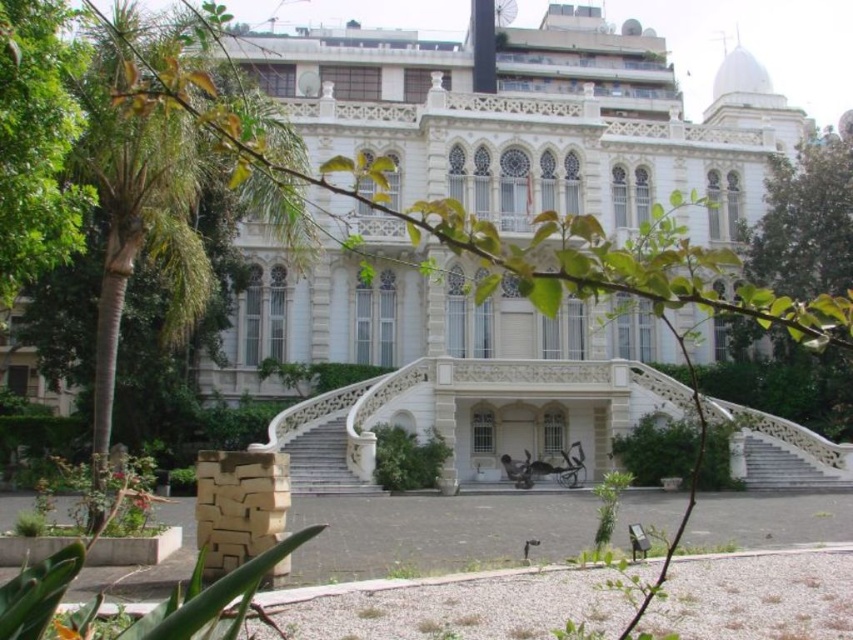
Who is more forward, (306, 481) or (802, 467)?

Point (306, 481) is in front.

Who is more forward, (x=328, y=460) or (x=811, y=476)?

Point (x=328, y=460) is more forward.

Where is `white marble staircase at center`? white marble staircase at center is located at coordinates (323, 461).

In the scene shown: Is green leafy tree at upper right to the right of white marble staircase at center from the viewer's perspective?

Indeed, green leafy tree at upper right is positioned on the right side of white marble staircase at center.

In order to click on green leafy tree at upper right in this screenshot , I will do `click(805, 220)`.

Who is more distant from viewer, (811, 200) or (310, 477)?

The point (811, 200) is behind.

Image resolution: width=853 pixels, height=640 pixels. I want to click on green leafy tree at upper right, so click(805, 220).

Is green leafy tree at left bigger than white stone staircase at center?

Correct, green leafy tree at left is larger in size than white stone staircase at center.

At what (x,y) coordinates should I click in order to perform the action: click on green leafy tree at left. Please return your answer as a coordinate pair (x, y). The height and width of the screenshot is (640, 853). Looking at the image, I should click on (36, 141).